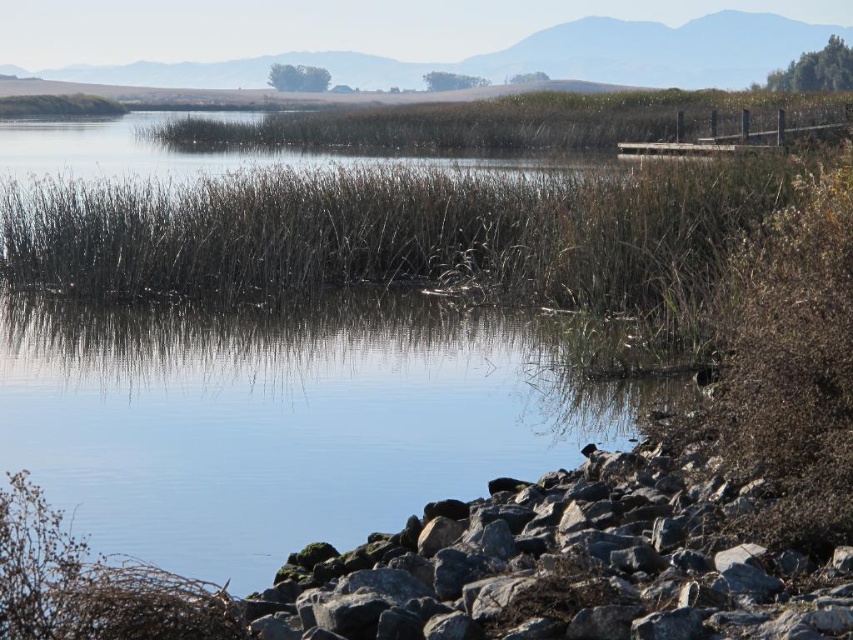
Who is higher up, gray rock at lower right or brown dry grass at lower left?

brown dry grass at lower left

Is gray rock at lower right closer to camera compared to brown dry grass at lower left?

No.

Is point (630, 477) positioned after point (64, 584)?

Yes, point (630, 477) is behind point (64, 584).

This screenshot has width=853, height=640. Identify the location of gray rock at lower right. (573, 563).

Does clear water at lower left have a greater height compared to brown dry grass at lower left?

Yes.

Between clear water at lower left and brown dry grass at lower left, which one has less height?

With less height is brown dry grass at lower left.

Does point (306, 307) lie behind point (230, 636)?

Yes, it is.

Where is `clear water at lower left`? The width and height of the screenshot is (853, 640). clear water at lower left is located at coordinates (286, 419).

Who is more forward, (328, 404) or (546, 611)?

Point (546, 611)

Who is shorter, clear water at lower left or gray rock at lower right?

gray rock at lower right is shorter.

Between point (254, 442) and point (824, 582), which one is positioned in front?

Point (824, 582)

Find the location of a particular element. clear water at lower left is located at coordinates (286, 419).